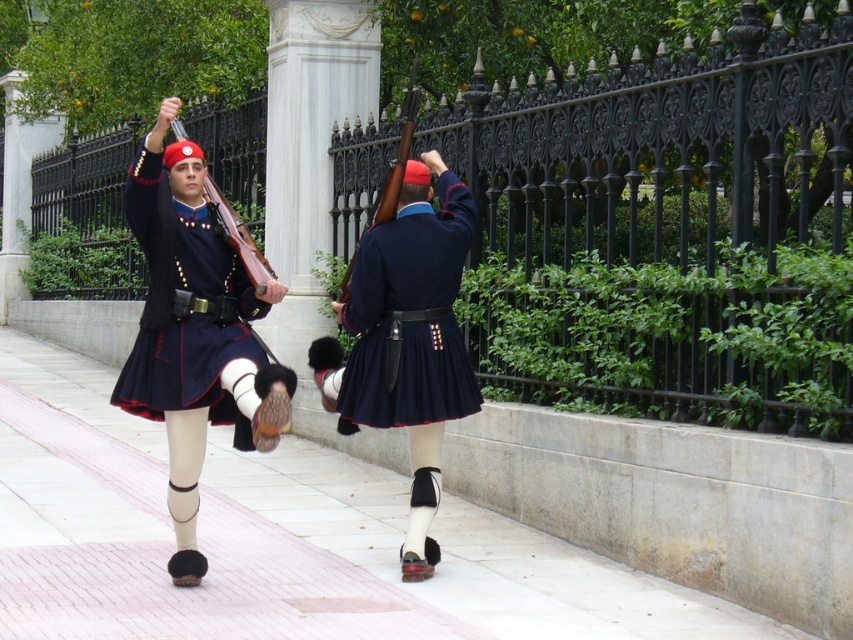
Question: Based on their relative distances, which object is nearer to the matte wood rifle at upper center?

Choices:
 (A) pink brick pavement at lower center
 (B) matte blue kilt at center
 (C) wooden rifle at center

Answer: (C)

Question: Can you confirm if wooden rifle at center is positioned below matte wood rifle at upper center?

Choices:
 (A) yes
 (B) no

Answer: (B)

Question: Which object is the farthest from the matte blue kilt at center?

Choices:
 (A) pink brick pavement at lower center
 (B) matte wood rifle at upper center
 (C) wooden rifle at center

Answer: (A)

Question: Which point is farther from the camera taking this photo?

Choices:
 (A) (337, 618)
 (B) (229, 243)

Answer: (B)

Question: Observing the image, what is the correct spatial positioning of matte blue kilt at center in reference to wooden rifle at center?

Choices:
 (A) right
 (B) left

Answer: (A)

Question: Is pink brick pavement at lower center to the left of matte wood rifle at upper center from the viewer's perspective?

Choices:
 (A) yes
 (B) no

Answer: (A)